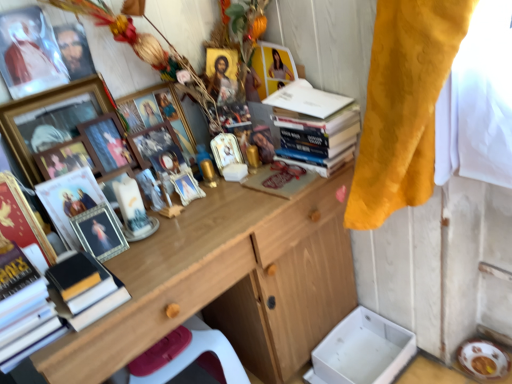
Question: Is matte black portrait at upper left taller or shorter than wooden desk at center?

Choices:
 (A) tall
 (B) short

Answer: (B)

Question: From the image's perspective, is matte black portrait at upper left above or below wooden desk at center?

Choices:
 (A) below
 (B) above

Answer: (B)

Question: Which of these objects is positioned closest to the matte wooden picture frame at center, marked as the 6th picture frame in a right-to-left arrangement?

Choices:
 (A) matte brown book at center, the second magazine positioned from the left
 (B) wooden desk at center
 (C) transparent plastic picture frame at upper left, the 9th picture frame from the right
 (D) hardcover books at upper right, the second book viewed from the front
 (E) gold-framed picture at upper left, which is the 8th picture frame in right-to-left order

Answer: (E)

Question: Which is farther from the hardcover books at upper right, the 1th book viewed from the back?

Choices:
 (A) wooden picture frame at center, the 7th picture frame when ordered from left to right
 (B) metallic gold picture frame at center, the first picture frame positioned from the right
 (C) silver metallic picture frame at center-left, the 5th picture frame when ordered from left to right
 (D) matte glass picture frame at center, which appears as the sixth picture frame when viewed from the left
 (E) matte wooden picture frame at center, the 4th picture frame in the left-to-right sequence

Answer: (C)